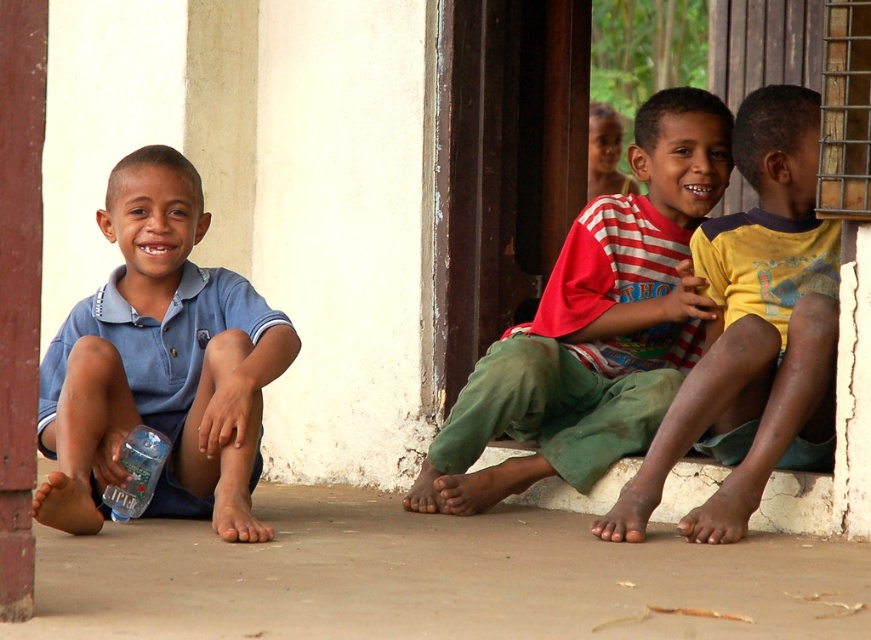
Question: Is red striped shirt at center bigger than clear plastic bottle at lower left?

Choices:
 (A) yes
 (B) no

Answer: (A)

Question: Does blue cotton shirt at left appear on the right side of yellow cotton shirt at center?

Choices:
 (A) no
 (B) yes

Answer: (A)

Question: Which point is farther from the camera taking this photo?

Choices:
 (A) (701, 408)
 (B) (659, 388)
 (C) (165, 449)
 (D) (227, 401)

Answer: (B)

Question: Which object appears farthest from the camera in this image?

Choices:
 (A) yellow cotton shirt at center
 (B) blue cotton shirt at left

Answer: (A)

Question: Observing the image, what is the correct spatial positioning of red striped shirt at center in reference to yellow cotton shirt at center?

Choices:
 (A) right
 (B) left

Answer: (B)

Question: Which object is closer to the camera taking this photo?

Choices:
 (A) red striped shirt at center
 (B) clear plastic bottle at lower left

Answer: (B)